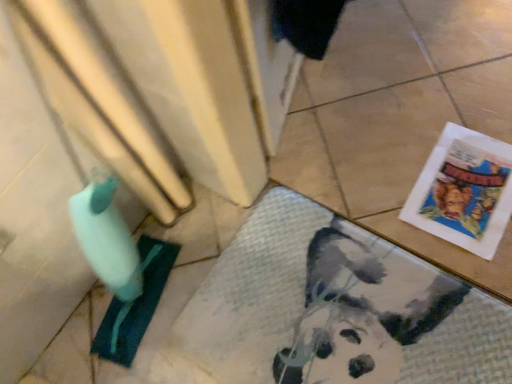
You are a GUI agent. You are given a task and a screenshot of the screen. Output one action in this format:
    pyautogui.click(x=<x>, y=<y>)
    Task: Click on the free space above white textured bath mat at lower right (from a real-world perspective)
    This screenshot has width=512, height=384.
    Given the screenshot: What is the action you would take?
    pyautogui.click(x=341, y=311)